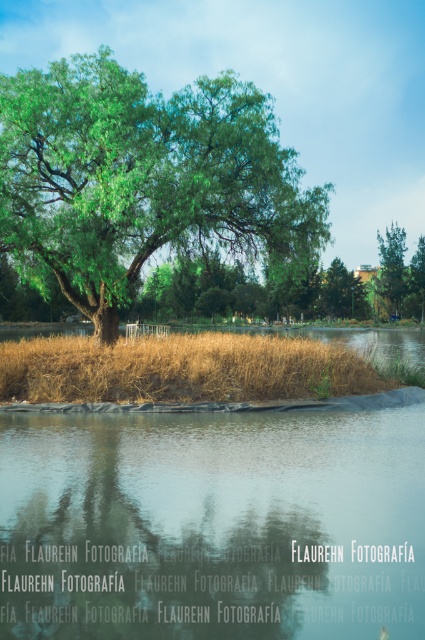
Question: Is green leafy tree at center bigger than dry grass at center?

Choices:
 (A) no
 (B) yes

Answer: (B)

Question: Does transparent glass water at lower center lie behind green leafy tree at center?

Choices:
 (A) no
 (B) yes

Answer: (A)

Question: Which of the following is the closest to the observer?

Choices:
 (A) (47, 349)
 (B) (388, 266)

Answer: (A)

Question: Can you confirm if dry grass at center is positioned above green leafy tree at upper center?

Choices:
 (A) yes
 (B) no

Answer: (B)

Question: Estimate the real-world distances between objects in this image. Which object is closer to the transparent glass water at lower center?

Choices:
 (A) green leafy tree at upper center
 (B) green leafy tree at center
 (C) dry grass at center

Answer: (C)

Question: Which object is the closest to the green leafy tree at upper center?

Choices:
 (A) green leafy tree at center
 (B) dry grass at center
 (C) transparent glass water at lower center

Answer: (A)